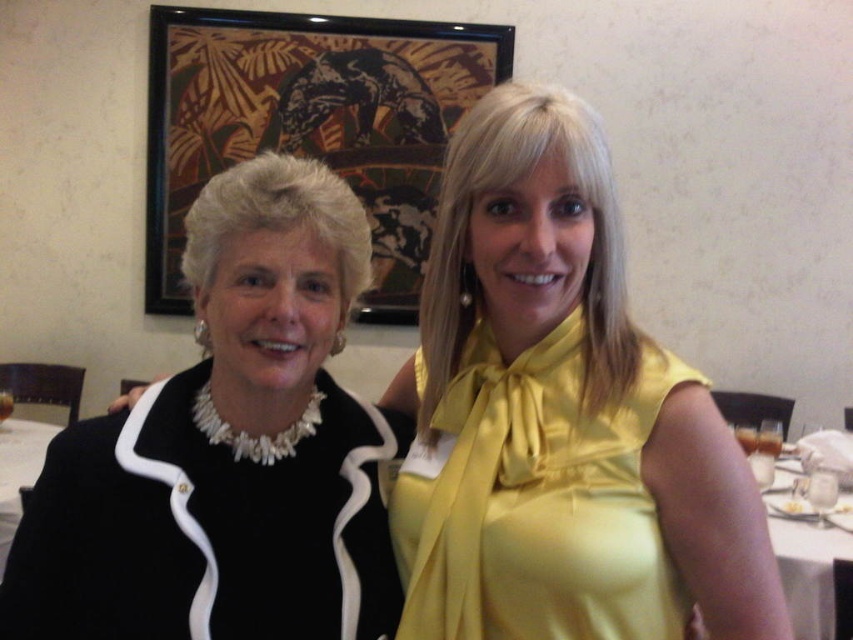
You are at a social event and need to identify the clothing items. Which clothing item is positioned higher up between the yellow satin blouse at center and the black satin jacket at left?

The yellow satin blouse at center is positioned higher up than the black satin jacket at left according to the description.

You are a photographer at a fashion show. You need to capture a photo that includes both the black satin jacket at left and the satin yellow dress at center. The camera lens has a minimum focus distance of 15 centimeters. Will you be able to focus on both subjects clearly?

The black satin jacket at left is 16.12 centimeters away from the satin yellow dress at center. Since the distance between them is greater than the camera lens minimum focus distance of 15 centimeters, the camera can focus on both subjects clearly.